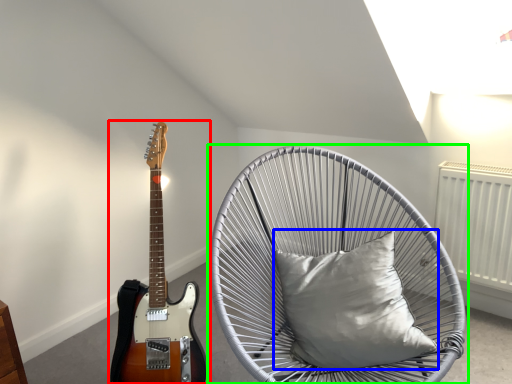
Question: Considering the real-world distances, which object is closest to guitar (highlighted by a red box)? pillow (highlighted by a blue box) or chair (highlighted by a green box).

Choices:
 (A) pillow
 (B) chair

Answer: (B)